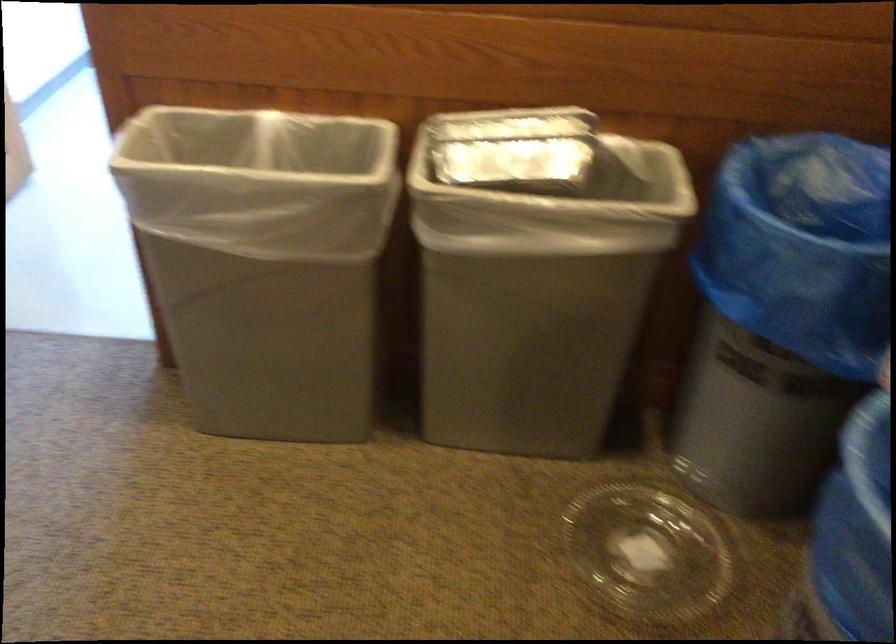
You are a GUI agent. You are given a task and a screenshot of the screen. Output one action in this format:
    pyautogui.click(x=<x>, y=<y>)
    Task: Click on the gray trash can
    The height and width of the screenshot is (644, 896).
    Given the screenshot: What is the action you would take?
    pyautogui.click(x=803, y=248)